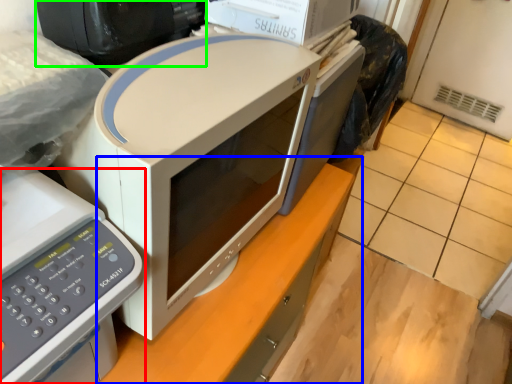
Question: Which object is positioned closest to home appliance (highlighted by a red box)? Select from computer desk (highlighted by a blue box) and desktop computer (highlighted by a green box).

Choices:
 (A) computer desk
 (B) desktop computer

Answer: (B)